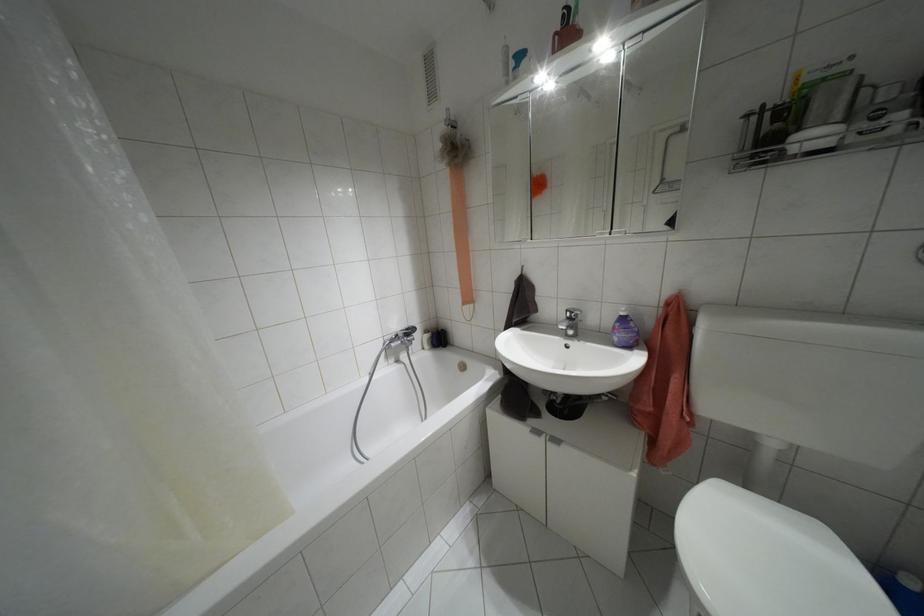
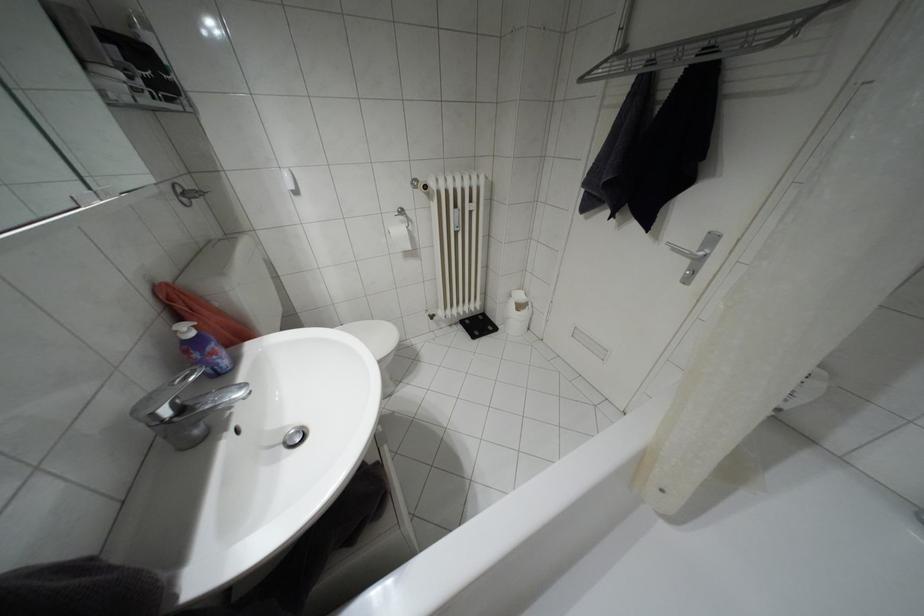
In the second image, find the point that corresponds to pixel 569 318 in the first image.

(180, 408)